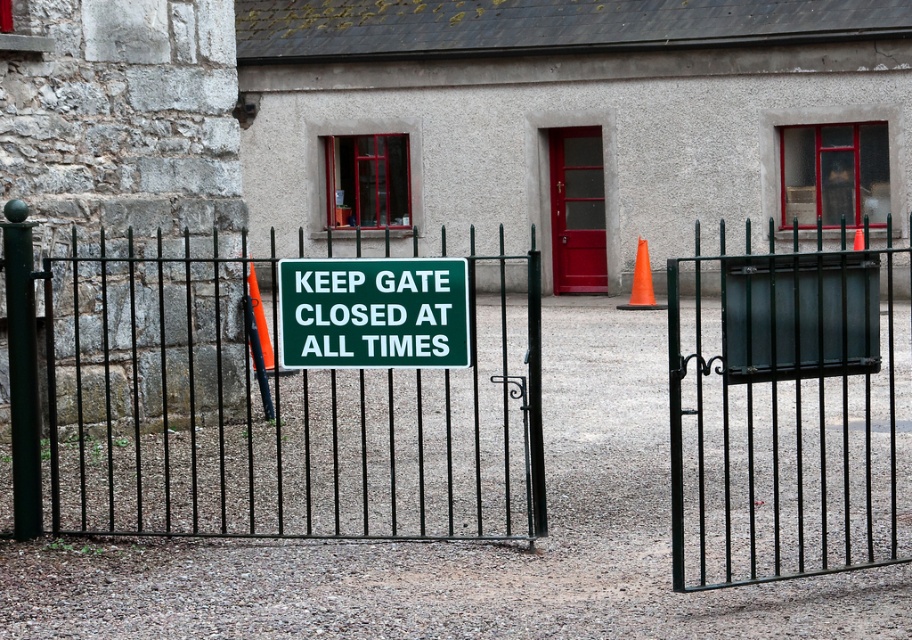
Who is shorter, black metal gate at center or red glossy door at center?

Standing shorter between the two is black metal gate at center.

Who is more distant from viewer, (169, 276) or (575, 253)?

Point (575, 253)

Find the location of a particular element. black metal gate at center is located at coordinates (276, 401).

Looking at this image, is green matte sign at center shorter than orange plastic traffic cone at center?

Correct, green matte sign at center is not as tall as orange plastic traffic cone at center.

Who is higher up, green matte sign at center or orange plastic traffic cone at center?

green matte sign at center

Between point (361, 358) and point (267, 346), which one is positioned in front?

Point (361, 358)

Locate an element on the screen. green matte sign at center is located at coordinates (374, 312).

Between green wrought iron gate at center and red glossy door at center, which one has more height?

With more height is green wrought iron gate at center.

The image size is (912, 640). In order to click on green wrought iron gate at center in this screenshot , I will do `click(789, 413)`.

Is point (805, 381) closer to camera compared to point (593, 291)?

Yes, it is in front of point (593, 291).

Find the location of a particular element. The height and width of the screenshot is (640, 912). green wrought iron gate at center is located at coordinates (789, 413).